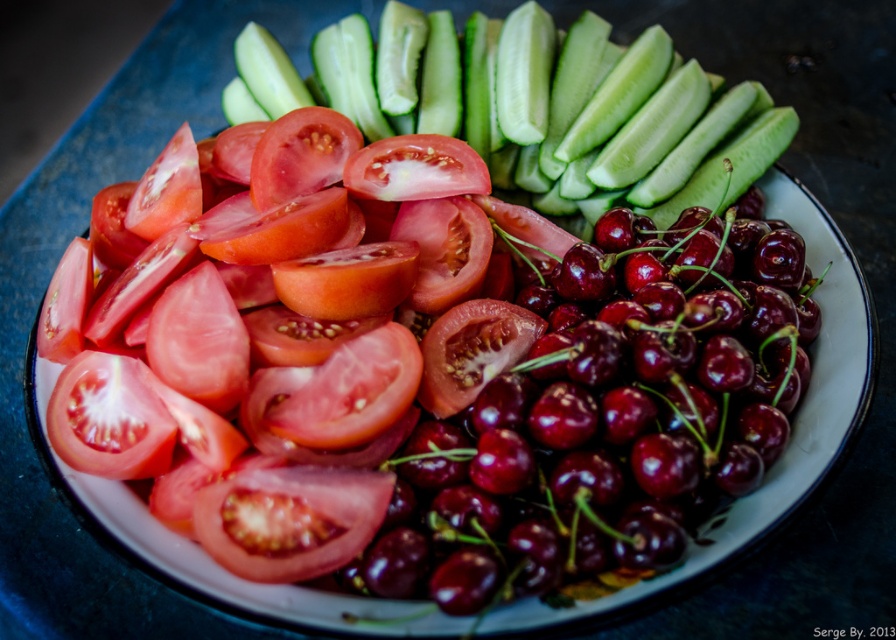
You are a food stylist arranging fruits on a platter. You have two points marked on the platter where you need to place items. The first point is at coordinate point [388,516] and the second is at point [769,131]. If you want to place a cherry tomato cluster closer to the viewer, which point should you choose?

Point [388,516] is closer to the viewer than point [769,131], so you should place the cherry tomato cluster at point [388,516] to make it appear closer.

You are arranging a fruit platter and need to place a shiny red tomato at center and a green smooth cucumber at upper center. Based on the scene, which object is closer to you?

The shiny red tomato at center is closer to you because it is in front of the green smooth cucumber at upper center.